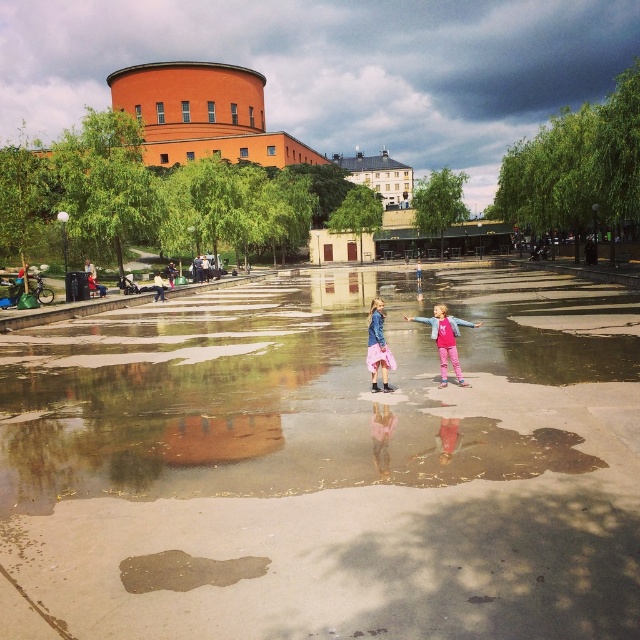
Question: Does pink fabric dress at center appear over pink satin skirt at center?

Choices:
 (A) no
 (B) yes

Answer: (B)

Question: Among these objects, which one is farthest from the camera?

Choices:
 (A) pink satin skirt at center
 (B) shiny concrete puddle at center
 (C) pink fabric dress at center

Answer: (C)

Question: Which point is closer to the camera?

Choices:
 (A) (381, 356)
 (B) (77, 416)

Answer: (B)

Question: Is shiny concrete puddle at center bigger than pink fabric dress at center?

Choices:
 (A) yes
 (B) no

Answer: (A)

Question: Which object is the closest to the pink fabric dress at center?

Choices:
 (A) pink satin skirt at center
 (B) shiny concrete puddle at center

Answer: (A)

Question: Is shiny concrete puddle at center to the left of pink fabric dress at center from the viewer's perspective?

Choices:
 (A) no
 (B) yes

Answer: (B)